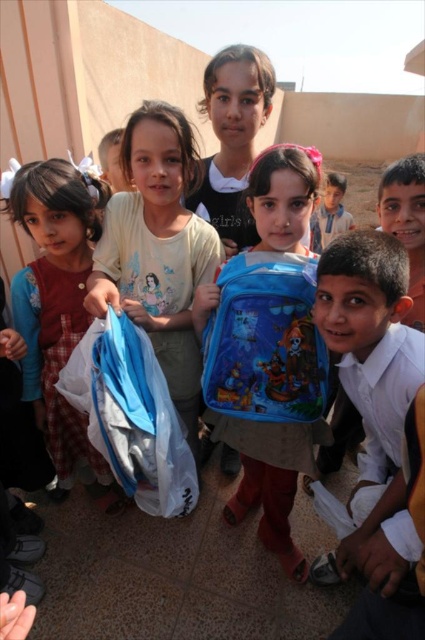
Who is taller, white matte plastic bag at center or matte red dress at left?

matte red dress at left

Describe the element at coordinates (158, 250) in the screenshot. I see `white matte plastic bag at center` at that location.

At what (x,y) coordinates should I click in order to perform the action: click on white matte plastic bag at center. Please return your answer as a coordinate pair (x, y). The image size is (425, 640). Looking at the image, I should click on (158, 250).

Where is `white matte plastic bag at center`? white matte plastic bag at center is located at coordinates (158, 250).

The width and height of the screenshot is (425, 640). What do you see at coordinates (56, 298) in the screenshot?
I see `matte red dress at left` at bounding box center [56, 298].

The image size is (425, 640). Find the location of `matte red dress at left`. matte red dress at left is located at coordinates (56, 298).

Is cartoon-patterned backpack at center further to the viewer compared to light brown hair at upper center?

No.

Image resolution: width=425 pixels, height=640 pixels. What do you see at coordinates (268, 348) in the screenshot?
I see `cartoon-patterned backpack at center` at bounding box center [268, 348].

The height and width of the screenshot is (640, 425). What are the coordinates of `cartoon-patterned backpack at center` in the screenshot? It's located at (268, 348).